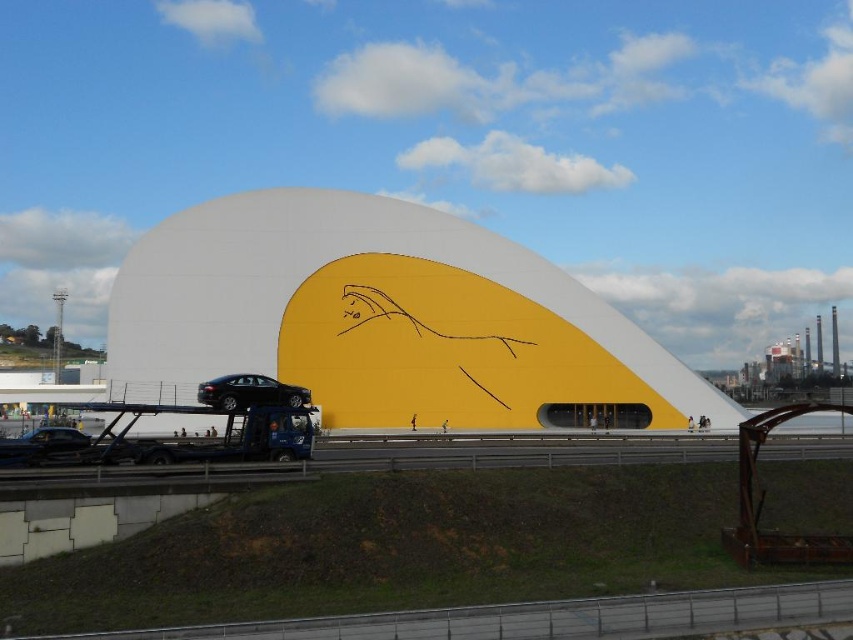
Does point (247, 269) come closer to viewer compared to point (207, 404)?

No, (247, 269) is behind (207, 404).

Is white matte dome at center below glossy black car at center?

Actually, white matte dome at center is above glossy black car at center.

This screenshot has height=640, width=853. What are the coordinates of `white matte dome at center` in the screenshot? It's located at (381, 317).

Image resolution: width=853 pixels, height=640 pixels. In order to click on white matte dome at center in this screenshot , I will do `click(381, 317)`.

Is white matte dome at center thinner than shiny black car at lower left?

No.

Does white matte dome at center appear on the right side of shiny black car at lower left?

Yes, white matte dome at center is to the right of shiny black car at lower left.

Locate an element on the screen. The image size is (853, 640). white matte dome at center is located at coordinates (381, 317).

In order to click on white matte dome at center in this screenshot , I will do `click(381, 317)`.

Between point (264, 392) and point (22, 461), which one is positioned in front?

Point (22, 461) is more forward.

Can you confirm if glossy black car at center is positioned above shiny black car at lower left?

Yes, glossy black car at center is above shiny black car at lower left.

At what (x,y) coordinates should I click in order to perform the action: click on glossy black car at center. Please return your answer as a coordinate pair (x, y). Looking at the image, I should click on (248, 392).